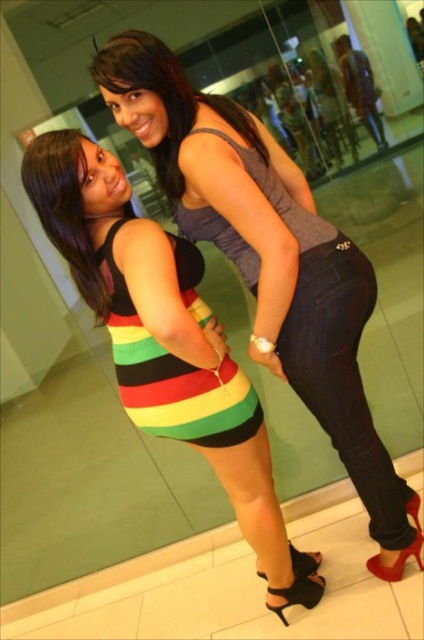
You are standing in front of the two women in the image. Which of the two points, point 1 at coordinates point (306,589) or point 2 at coordinates point (256,426), is closer to you?

Point 1 at coordinates point (306,589) is closer to you because it is further to the viewer than point 2 at coordinates point (256,426).

You are a fashion designer who needs to create a new collection. You are looking at the image and want to know which item of clothing has a wider silhouette between the multicolored striped tank top at center and the striped fabric dress at lower left. Which one should you choose?

The multicolored striped tank top at center has a larger width than the striped fabric dress at lower left, so you should choose the multicolored striped tank top at center for a wider silhouette.